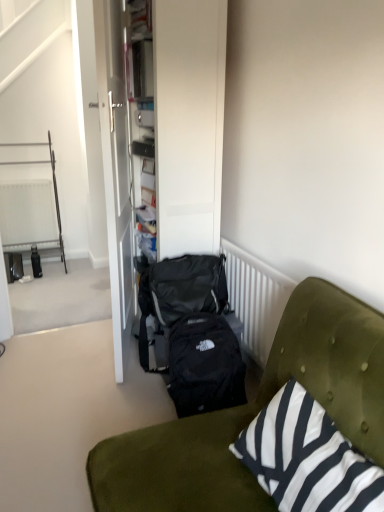
Locate an element on the screen. Image resolution: width=384 pixels, height=512 pixels. vacant area that is in front of metal/textured rack at left is located at coordinates (28, 284).